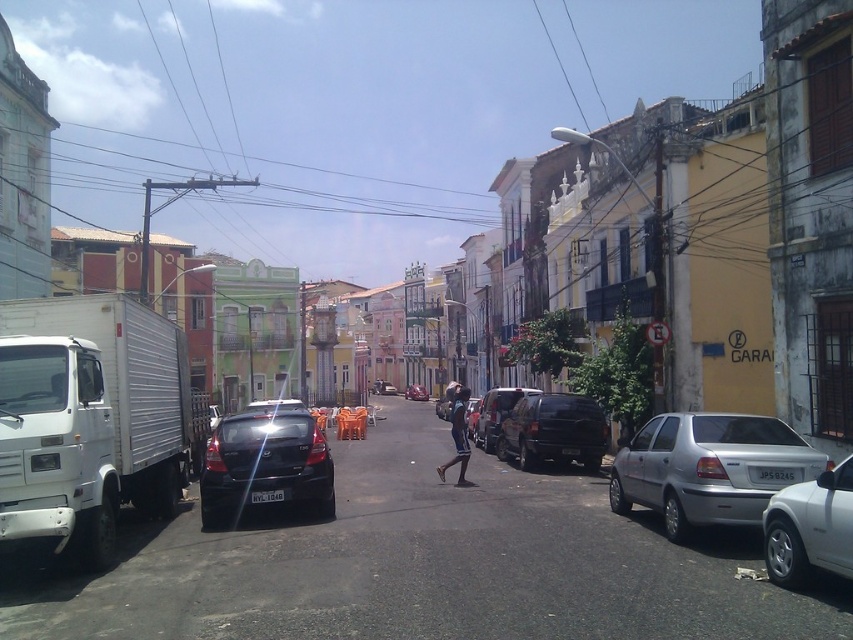
Question: Which object appears farthest from the camera in this image?

Choices:
 (A) white matte truck at left
 (B) silver metallic car at lower right
 (C) dark blue fabric pants at center

Answer: (C)

Question: Does white matte truck at left appear on the right side of white metallic truck at left?

Choices:
 (A) no
 (B) yes

Answer: (B)

Question: Which object is the farthest from the shiny red car at center?

Choices:
 (A) white matte truck at left
 (B) white metallic truck at left

Answer: (B)

Question: Does shiny black van at center appear under shiny black suv at center?

Choices:
 (A) yes
 (B) no

Answer: (A)

Question: Among these objects, which one is nearest to the camera?

Choices:
 (A) shiny black hatchback at center
 (B) shiny red car at center

Answer: (A)

Question: Is silver metallic sedan at center-right smaller than shiny black van at center?

Choices:
 (A) no
 (B) yes

Answer: (B)